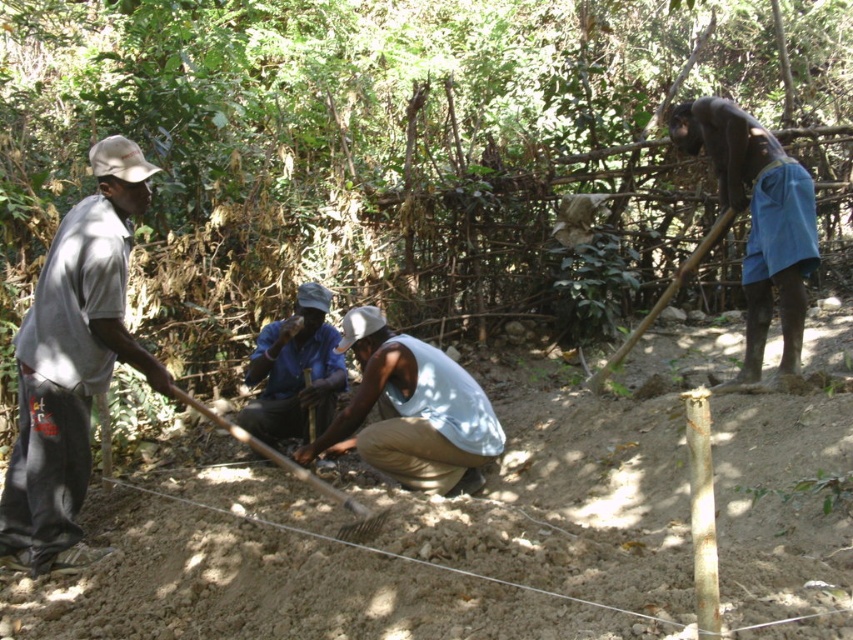
You are a hiker passing by the scene and need to determine which clothing item is more suitable for the current weather based on their visibility in the image. Which of the two, the gray cotton shirt at left or the light blue sleeveless shirt at center, is more likely to be appropriate for the weather?

The light blue sleeveless shirt at center is more appropriate for the weather because it is thicker than the gray cotton shirt at left, suggesting better protection against the elements.

Please look at the image. There is a point at coordinate [758,220]. Which object from the list below is located at that point? Choose from the following options. A. The man in light gray shirt and beige cap. B. The blue fabric shorts at right. C. The long handled tool. D. The seated individual near the man.

The point at coordinate [758,220] is located on the blue fabric shorts at right, so the correct answer is B.